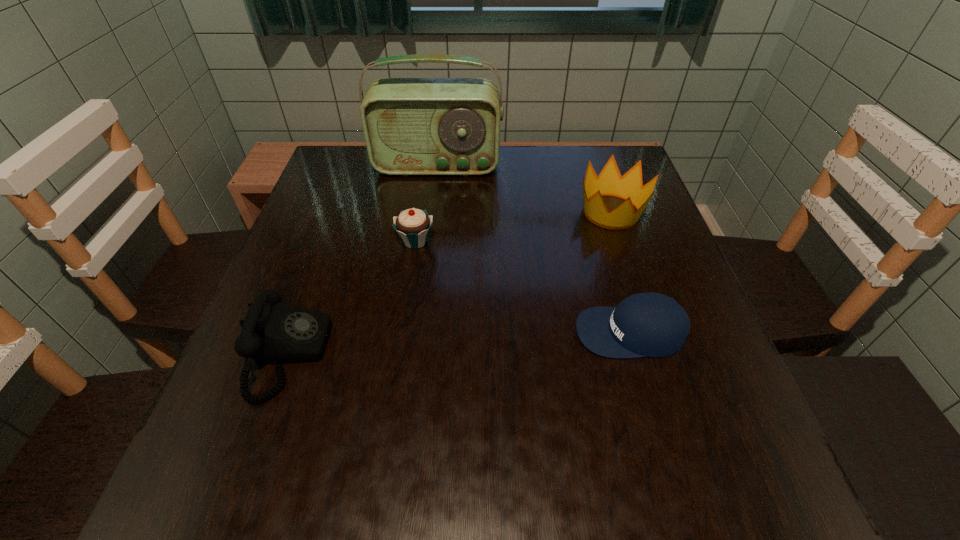
I want to click on object at the far right corner, so click(609, 182).

Where is `vacant region at the far edge of the desktop`? This screenshot has width=960, height=540. vacant region at the far edge of the desktop is located at coordinates (462, 193).

Image resolution: width=960 pixels, height=540 pixels. I want to click on free space at the near edge, so click(533, 475).

I want to click on vacant area at the left edge of the desktop, so click(276, 435).

Where is `vacant space at the right edge of the desktop`? The image size is (960, 540). vacant space at the right edge of the desktop is located at coordinates (645, 220).

I want to click on vacant space at the far left corner of the desktop, so click(353, 188).

Where is `vacant space at the far right corner`? vacant space at the far right corner is located at coordinates (600, 146).

In the image, there is a desktop. At what (x,y) coordinates should I click in order to perform the action: click on vacant area at the near right corner. Please return your answer as a coordinate pair (x, y). Image resolution: width=960 pixels, height=540 pixels. Looking at the image, I should click on (732, 501).

Find the location of `vacant space that is in between the tallest object and the cupcake`. vacant space that is in between the tallest object and the cupcake is located at coordinates (426, 204).

You are a GUI agent. You are given a task and a screenshot of the screen. Output one action in this format:
    pyautogui.click(x=<x>, y=<y>)
    Task: Click on the free area in between the crown and the farthest object
    Image resolution: width=960 pixels, height=540 pixels.
    Given the screenshot: What is the action you would take?
    pyautogui.click(x=524, y=189)